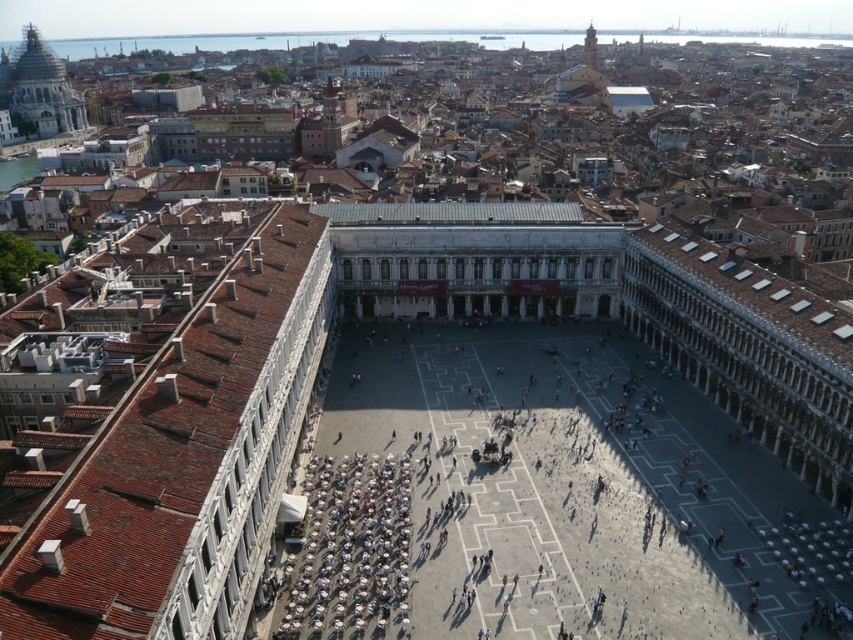
Does white stone square at center appear on the left side of white plastic chairs at lower left?

In fact, white stone square at center is to the right of white plastic chairs at lower left.

Consider the image. Between white stone square at center and white plastic chairs at lower left, which one is positioned lower?

Positioned lower is white plastic chairs at lower left.

Is point (548, 387) closer to camera compared to point (376, 573)?

No, it is not.

Where is `white stone square at center`? white stone square at center is located at coordinates (548, 500).

Can you confirm if terracotta tiled roof at left is bigger than white plastic chairs at lower left?

Yes.

Can you confirm if terracotta tiled roof at left is smaller than white plastic chairs at lower left?

Actually, terracotta tiled roof at left might be larger than white plastic chairs at lower left.

Is point (194, 342) positioned before point (410, 500)?

That is True.

The image size is (853, 640). What are the coordinates of `terracotta tiled roof at left` in the screenshot? It's located at (184, 461).

What do you see at coordinates (347, 548) in the screenshot? This screenshot has width=853, height=640. I see `white plastic chairs at lower left` at bounding box center [347, 548].

Find the location of a particular element. white plastic chairs at lower left is located at coordinates (347, 548).